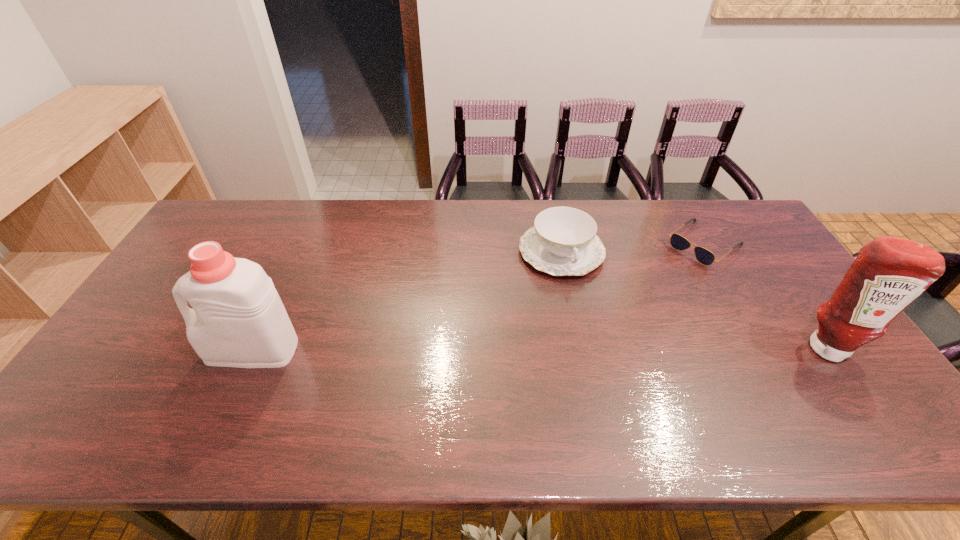
Find the location of a particular element. empty location between the third tallest object and the leftmost object is located at coordinates (407, 301).

The height and width of the screenshot is (540, 960). Find the location of `vacant area between the shortest object and the third tallest object`. vacant area between the shortest object and the third tallest object is located at coordinates pyautogui.click(x=633, y=248).

You are a GUI agent. You are given a task and a screenshot of the screen. Output one action in this format:
    pyautogui.click(x=<x>, y=<y>)
    Task: Click on the empty space that is in between the sunglasses and the second shortest object
    This screenshot has height=540, width=960.
    Given the screenshot: What is the action you would take?
    pyautogui.click(x=633, y=248)

You are a GUI agent. You are given a task and a screenshot of the screen. Output one action in this format:
    pyautogui.click(x=<x>, y=<y>)
    Task: Click on the vacant area that lies between the condiment and the second shortest object
    This screenshot has width=960, height=540.
    Given the screenshot: What is the action you would take?
    pyautogui.click(x=694, y=299)

I want to click on blank region between the sunglasses and the condiment, so click(765, 295).

Locate an element on the screen. object that ranks as the third closest to the third tallest object is located at coordinates (238, 320).

At what (x,y) coordinates should I click in order to perform the action: click on object that can be found as the third closest to the shortest object. Please return your answer as a coordinate pair (x, y). This screenshot has height=540, width=960. Looking at the image, I should click on (238, 320).

At what (x,y) coordinates should I click in order to perform the action: click on vacant area that satisfies the following two spatial constraints: 1. on the front side of the third object from right to left; 2. on the right side of the condiment. Please return your answer as a coordinate pair (x, y). The height and width of the screenshot is (540, 960). Looking at the image, I should click on click(x=580, y=346).